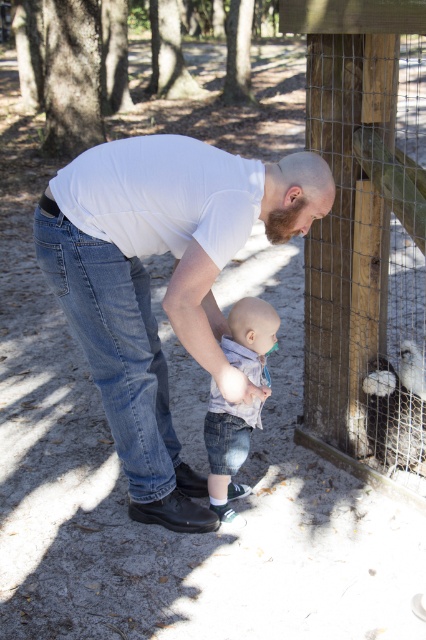
Is white matte shirt at center further to the viewer compared to denim shorts at center?

No, it is not.

Is white matte shirt at center smaller than denim shorts at center?

Incorrect, white matte shirt at center is not smaller in size than denim shorts at center.

The height and width of the screenshot is (640, 426). What do you see at coordinates (167, 284) in the screenshot?
I see `white matte shirt at center` at bounding box center [167, 284].

This screenshot has height=640, width=426. I want to click on white matte shirt at center, so click(x=167, y=284).

Does wooden post at right have a greater height compared to denim shorts at center?

Indeed, wooden post at right has a greater height compared to denim shorts at center.

Consider the image. Between wooden post at right and denim shorts at center, which one appears on the left side from the viewer's perspective?

Positioned to the left is denim shorts at center.

Where is `wooden post at right`? The height and width of the screenshot is (640, 426). wooden post at right is located at coordinates (367, 228).

Does white matte shirt at center have a lesser height compared to wooden post at right?

Yes, white matte shirt at center is shorter than wooden post at right.

Is white matte shirt at center taller than wooden post at right?

No.

Where is `white matte shirt at center`? The image size is (426, 640). white matte shirt at center is located at coordinates (167, 284).

The width and height of the screenshot is (426, 640). Find the location of `white matte shirt at center`. white matte shirt at center is located at coordinates (167, 284).